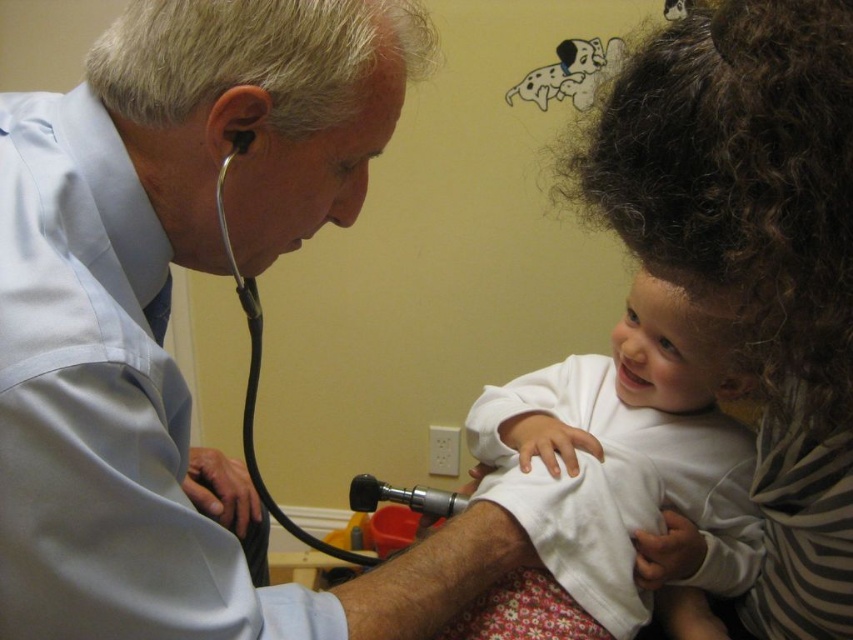
You are a medical student observing a pediatrician examining a child. You notice the curly brown hair at upper right and the metallic black stethoscope at left. Which object takes up more space in the image?

The metallic black stethoscope at left takes up more space in the image than the curly brown hair at upper right.

You are a nurse in a pediatric clinic. You need to place the white soft baby at center and the metallic black stethoscope at left on a shelf. Which object should you place first if you want to place the taller object on the higher shelf?

The metallic black stethoscope at left is taller than the white soft baby at center, so you should place the metallic black stethoscope at left first on the higher shelf.